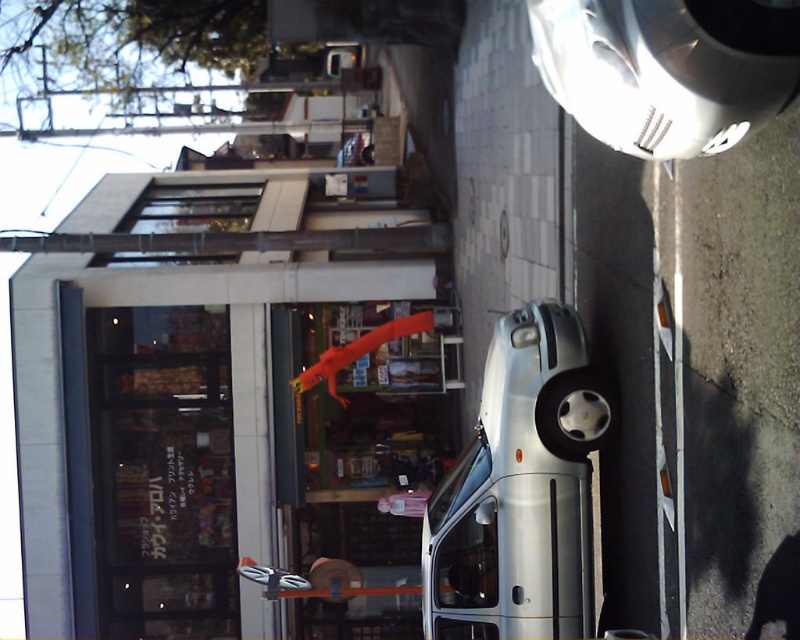
Between silver metallic van at center and silver metallic car at upper right, which one has more height?

With more height is silver metallic van at center.

You are a GUI agent. You are given a task and a screenshot of the screen. Output one action in this format:
    pyautogui.click(x=<x>, y=<y>)
    Task: Click on the silver metallic van at center
    Image resolution: width=800 pixels, height=640 pixels.
    Given the screenshot: What is the action you would take?
    pyautogui.click(x=520, y=492)

Is point (574, 340) farther from camera compared to point (684, 134)?

Yes, it is.

Identify the location of silver metallic van at center. (520, 492).

Does silver metallic van at center have a lesser height compared to rubber orange lizard at center?

Incorrect, silver metallic van at center's height does not fall short of rubber orange lizard at center's.

Is point (478, 588) less distant than point (344, 344)?

Yes, point (478, 588) is in front of point (344, 344).

Is point (568, 573) positioned in front of point (336, 352)?

Yes, point (568, 573) is closer to viewer.

This screenshot has width=800, height=640. What are the coordinates of `silver metallic van at center` in the screenshot? It's located at (520, 492).

Which of these two, silver metallic car at upper right or rubber orange lizard at center, stands taller?

Standing taller between the two is rubber orange lizard at center.

Image resolution: width=800 pixels, height=640 pixels. Find the location of `silver metallic car at upper right`. silver metallic car at upper right is located at coordinates point(668,68).